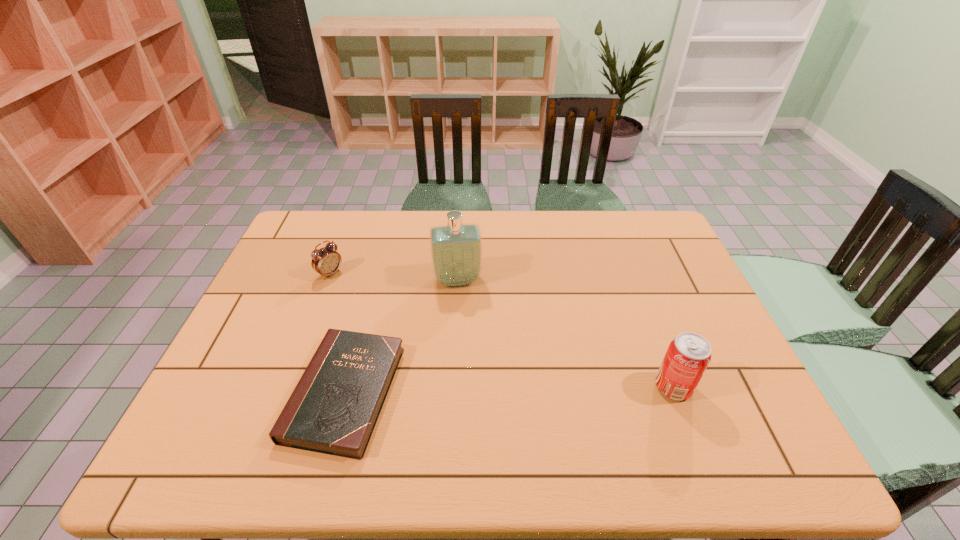
Locate an element on the screen. This screenshot has width=960, height=540. vacant space on the desktop that is between the Bible and the rightmost object and is positioned on the front label of the third object from left to right is located at coordinates (472, 390).

At what (x,y) coordinates should I click in order to perform the action: click on vacant space on the desktop that is between the Bible and the rightmost object and is positioned on the face of the third tallest object. Please return your answer as a coordinate pair (x, y). This screenshot has height=540, width=960. Looking at the image, I should click on (495, 390).